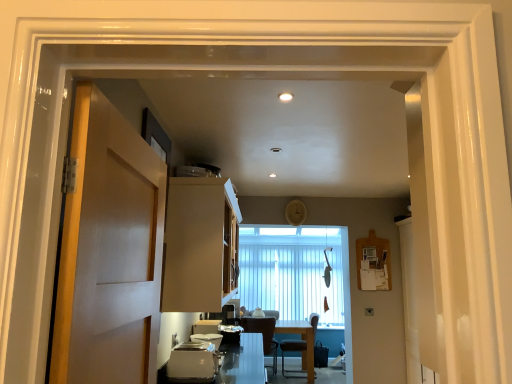
Question: Is white glossy countertop at lower center smaller than satin silver toaster at lower center?

Choices:
 (A) yes
 (B) no

Answer: (B)

Question: Does white glossy countertop at lower center have a lesser height compared to satin silver toaster at lower center?

Choices:
 (A) yes
 (B) no

Answer: (B)

Question: Is white glossy countertop at lower center with satin silver toaster at lower center?

Choices:
 (A) yes
 (B) no

Answer: (B)

Question: Could satin silver toaster at lower center be considered to be inside white glossy countertop at lower center?

Choices:
 (A) yes
 (B) no

Answer: (B)

Question: Is white glossy countertop at lower center positioned behind satin silver toaster at lower center?

Choices:
 (A) no
 (B) yes

Answer: (B)

Question: From the image's perspective, is white glossy countertop at lower center located above or below satin silver toaster at lower center?

Choices:
 (A) below
 (B) above

Answer: (A)

Question: Considering the positions of white glossy countertop at lower center and satin silver toaster at lower center in the image, is white glossy countertop at lower center wider or thinner than satin silver toaster at lower center?

Choices:
 (A) wide
 (B) thin

Answer: (A)

Question: Is white glossy countertop at lower center to the left or to the right of satin silver toaster at lower center in the image?

Choices:
 (A) right
 (B) left

Answer: (A)

Question: From a real-world perspective, is white glossy countertop at lower center above or below satin silver toaster at lower center?

Choices:
 (A) above
 (B) below

Answer: (B)

Question: Do you think matte wood cabinet at center is within white glossy countertop at lower center, or outside of it?

Choices:
 (A) outside
 (B) inside

Answer: (A)

Question: In terms of size, does matte wood cabinet at center appear bigger or smaller than white glossy countertop at lower center?

Choices:
 (A) small
 (B) big

Answer: (B)

Question: From a real-world perspective, relative to white glossy countertop at lower center, is matte wood cabinet at center vertically above or below?

Choices:
 (A) below
 (B) above

Answer: (B)

Question: In terms of height, does matte wood cabinet at center look taller or shorter compared to white glossy countertop at lower center?

Choices:
 (A) tall
 (B) short

Answer: (A)

Question: In terms of height, does matte white door at left look taller or shorter compared to satin silver toaster at lower center?

Choices:
 (A) tall
 (B) short

Answer: (A)

Question: Is matte white door at left wider or thinner than satin silver toaster at lower center?

Choices:
 (A) thin
 (B) wide

Answer: (A)